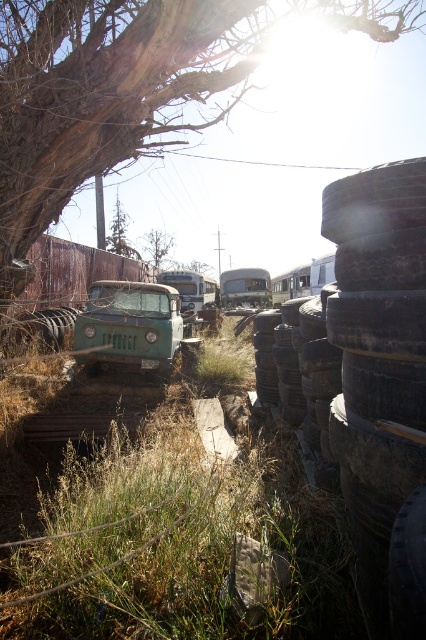
Is point (126, 90) positioned after point (167, 243)?

No, (126, 90) is in front of (167, 243).

This screenshot has height=640, width=426. Find the location of `brown rough bark tree at upper left`. brown rough bark tree at upper left is located at coordinates (127, 88).

Measure the distance between brown rough bark tree at upper left and camera.

brown rough bark tree at upper left is 15.34 feet away from camera.

At what (x,y) coordinates should I click in order to perform the action: click on brown rough bark tree at upper left. Please return your answer as a coordinate pair (x, y). The image size is (426, 640). Looking at the image, I should click on (127, 88).

Is point (39, 84) positioned in front of point (60, 330)?

Yes.

Is brown rough bark tree at upper left smaller than dark gray rubber tire at center?

No, brown rough bark tree at upper left is not smaller than dark gray rubber tire at center.

Between point (75, 29) and point (34, 333), which one is positioned behind?

Point (34, 333)

This screenshot has width=426, height=640. I want to click on brown rough bark tree at upper left, so click(127, 88).

Which is more to the right, charcoal rubber tires at right or metallic silver school bus at center?

From the viewer's perspective, metallic silver school bus at center appears more on the right side.

What do you see at coordinates (380, 381) in the screenshot? The width and height of the screenshot is (426, 640). I see `charcoal rubber tires at right` at bounding box center [380, 381].

What are the coordinates of `charcoal rubber tires at right` in the screenshot? It's located at point(380,381).